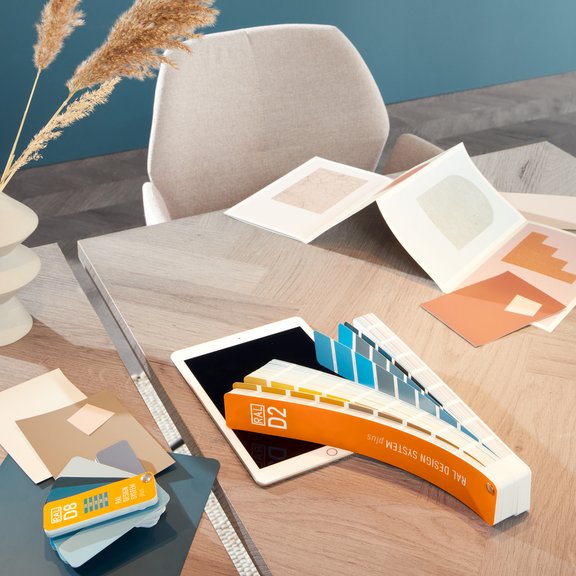
Find the location of a particular element. This screenshot has width=576, height=576. white chair with arms is located at coordinates (332, 84).